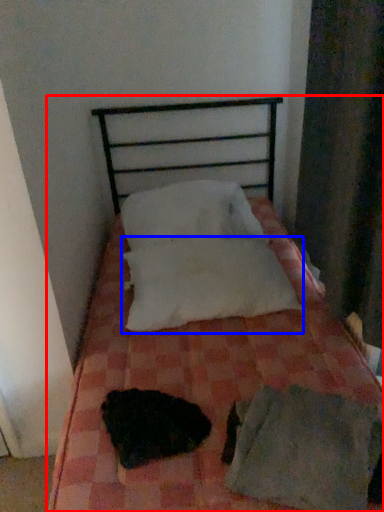
Question: Among these objects, which one is farthest to the camera, bed (highlighted by a red box) or pillow (highlighted by a blue box)?

Choices:
 (A) bed
 (B) pillow

Answer: (B)